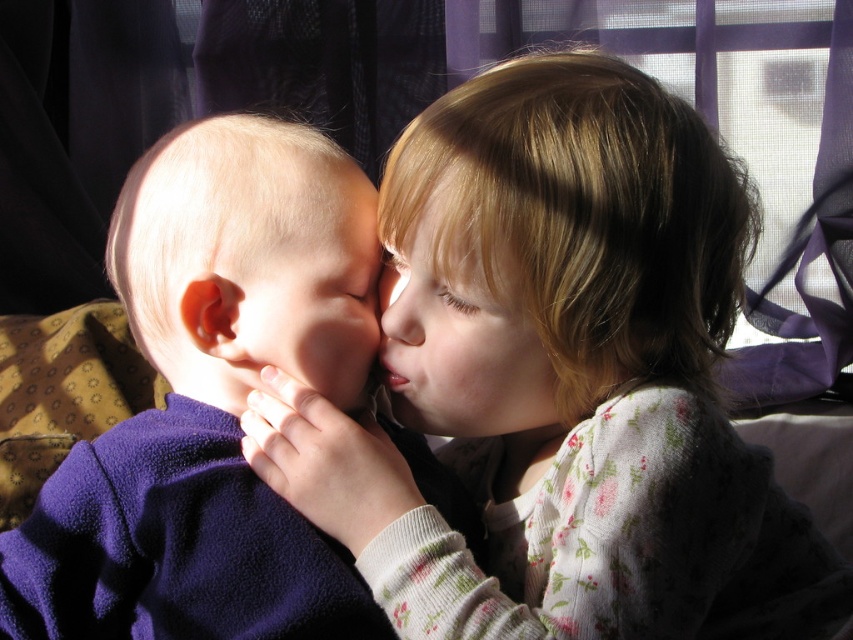
Question: Among these objects, which one is farthest from the camera?

Choices:
 (A) soft purple fleece at left
 (B) smooth skin face at center

Answer: (B)

Question: Does fluffy pink sweater at center appear over smooth skin face at center?

Choices:
 (A) yes
 (B) no

Answer: (B)

Question: Based on their relative distances, which object is nearer to the fluffy pink sweater at center?

Choices:
 (A) smooth skin face at center
 (B) blonde hair at upper right
 (C) smooth skin nose at center
 (D) soft purple fleece at left

Answer: (B)

Question: Is smooth skin face at center to the right of smooth skin nose at center from the viewer's perspective?

Choices:
 (A) yes
 (B) no

Answer: (B)

Question: Which object is the farthest from the soft purple fleece at left?

Choices:
 (A) fluffy pink sweater at center
 (B) smooth skin face at center
 (C) blonde hair at upper right

Answer: (C)

Question: Does fluffy pink sweater at center come in front of blonde hair at upper right?

Choices:
 (A) no
 (B) yes

Answer: (B)